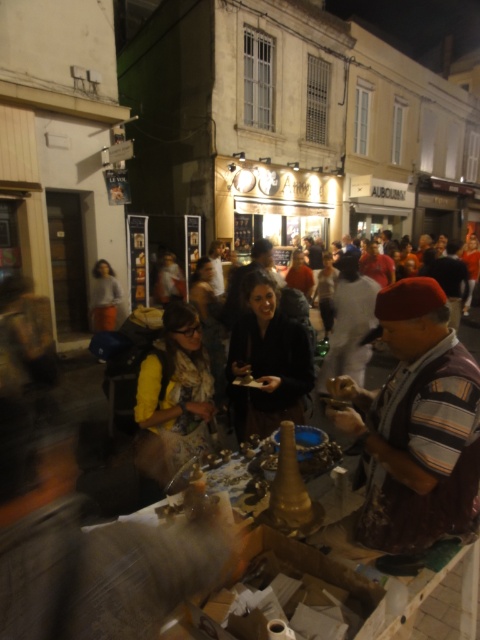
Question: Which point is farther to the camera?

Choices:
 (A) wooden table at center
 (B) yellow fabric at center
 (C) dark brown leather jacket at center
 (D) striped fabric beret at center

Answer: (B)

Question: Does striped fabric beret at center have a greater width compared to dark brown leather jacket at center?

Choices:
 (A) no
 (B) yes

Answer: (A)

Question: Estimate the real-world distances between objects in this image. Which object is closer to the yellow fabric at center?

Choices:
 (A) striped fabric beret at center
 (B) wooden table at center

Answer: (A)

Question: Is yellow fabric at center smaller than wooden table at center?

Choices:
 (A) no
 (B) yes

Answer: (B)

Question: Considering the real-world distances, which object is farthest from the striped fabric beret at center?

Choices:
 (A) wooden table at center
 (B) dark brown leather jacket at center
 (C) yellow fabric at center

Answer: (C)

Question: From the image, what is the correct spatial relationship of striped fabric beret at center in relation to wooden table at center?

Choices:
 (A) left
 (B) right

Answer: (A)